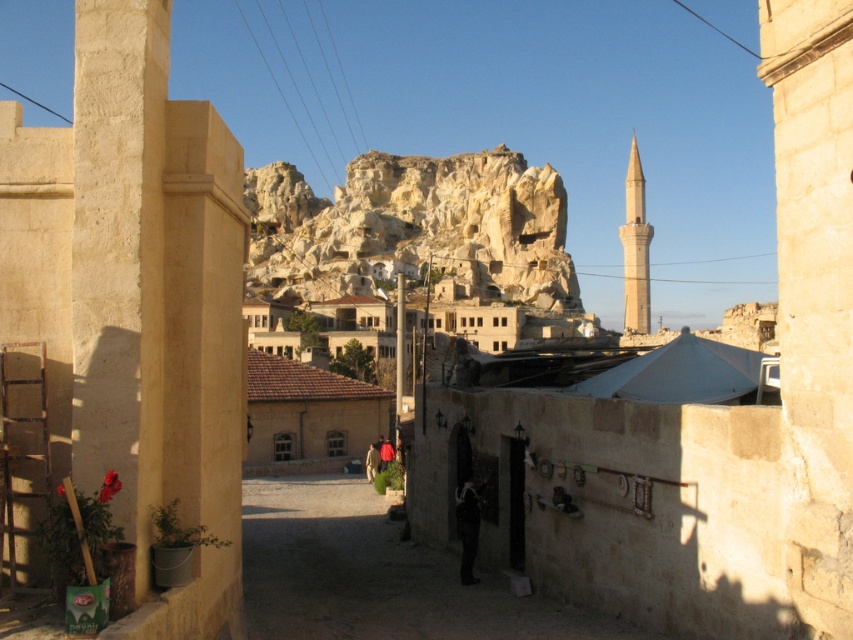
Question: Which point is farther from the camera taking this photo?

Choices:
 (A) (631, 225)
 (B) (537, 609)
 (C) (114, 200)
 (D) (457, 163)

Answer: (D)

Question: Is beige stone pillar at left to the right of smooth beige minaret at center-right from the viewer's perspective?

Choices:
 (A) yes
 (B) no

Answer: (B)

Question: Which point is closer to the camera?

Choices:
 (A) (148, 288)
 (B) (305, 241)

Answer: (A)

Question: Which point is closer to the camera?

Choices:
 (A) (328, 593)
 (B) (363, 180)
 (C) (82, 17)
 (D) (636, 184)

Answer: (C)

Question: Does beige stone pillar at left appear on the left side of light beige rock formation at center?

Choices:
 (A) yes
 (B) no

Answer: (B)

Question: Considering the relative positions of beige stone pillar at left and light beige rock formation at center in the image provided, where is beige stone pillar at left located with respect to light beige rock formation at center?

Choices:
 (A) right
 (B) left

Answer: (A)